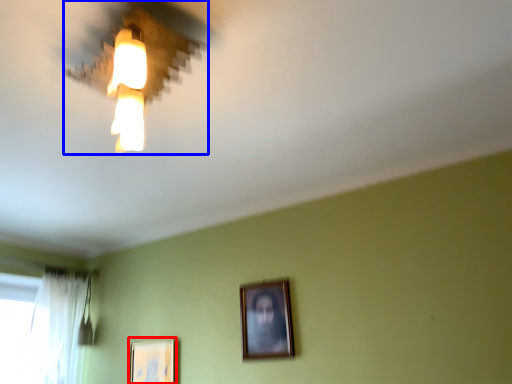
Question: Which object appears closest to the camera in this image, picture frame (highlighted by a red box) or lamp (highlighted by a blue box)?

Choices:
 (A) picture frame
 (B) lamp

Answer: (B)